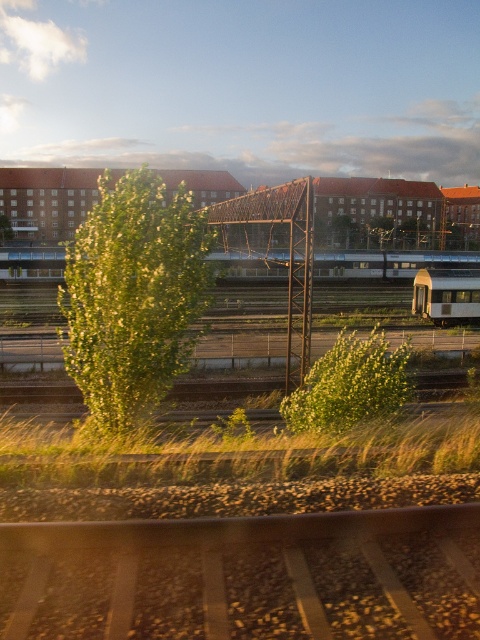
Question: Can you confirm if brown gravel train track at bottom is smaller than white glossy passenger train at center?

Choices:
 (A) yes
 (B) no

Answer: (A)

Question: Which object is closer to the camera taking this photo?

Choices:
 (A) green leafy tree at left
 (B) white glossy passenger train at center

Answer: (B)

Question: Which point is closer to the camera?

Choices:
 (A) brown gravel train track at bottom
 (B) green leafy tree at center

Answer: (A)

Question: Which point appears closest to the camera in this image?

Choices:
 (A) (216, 604)
 (B) (168, 205)
 (C) (39, 280)
 (D) (422, 308)

Answer: (A)

Question: Where is brown gravel train track at bottom located in relation to silver metallic train at center in the image?

Choices:
 (A) left
 (B) right

Answer: (A)

Question: Can you confirm if green leafy tree at center is wider than green leafy tree at left?

Choices:
 (A) yes
 (B) no

Answer: (A)